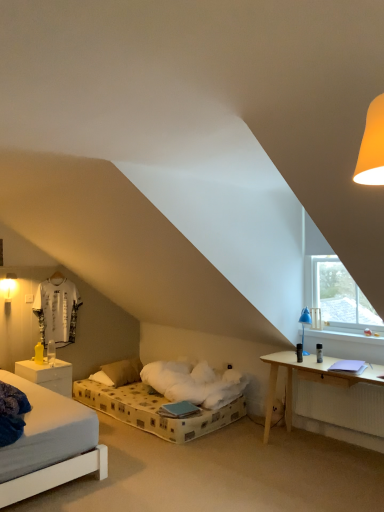
Question: Is transparent glass window at upper right in front of or behind white matte nightstand at lower left in the image?

Choices:
 (A) behind
 (B) front

Answer: (B)

Question: From the image's perspective, is transparent glass window at upper right located above or below white matte nightstand at lower left?

Choices:
 (A) above
 (B) below

Answer: (A)

Question: Which object is the farthest from the white jersey at left?

Choices:
 (A) blue plastic table lamp at right
 (B) matte white wall sconce at left
 (C) transparent glass window at upper right
 (D) white matte nightstand at lower left

Answer: (C)

Question: Which is farther from the white jersey at left?

Choices:
 (A) white matte nightstand at lower left
 (B) matte white wall sconce at left
 (C) blue plastic table lamp at right
 (D) transparent glass window at upper right

Answer: (D)